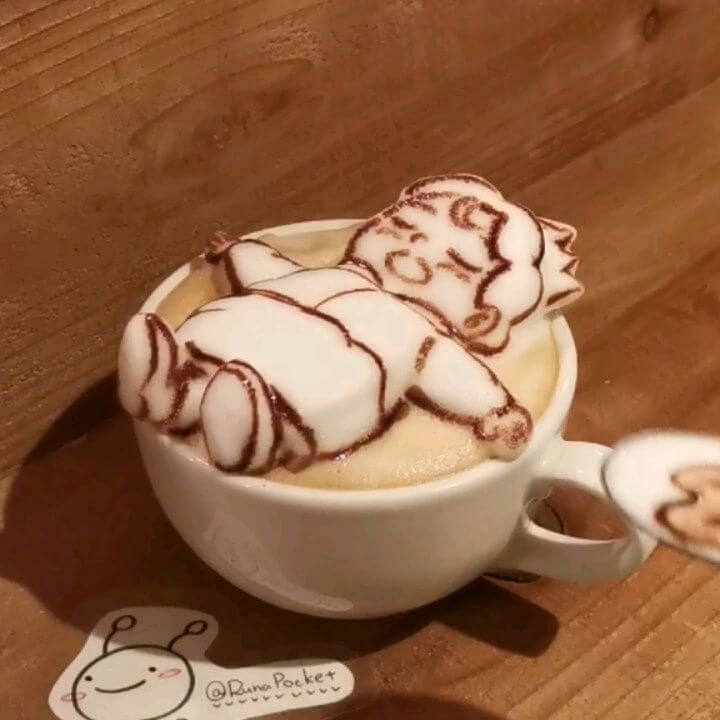
The width and height of the screenshot is (720, 720). I want to click on handle, so click(x=631, y=551).